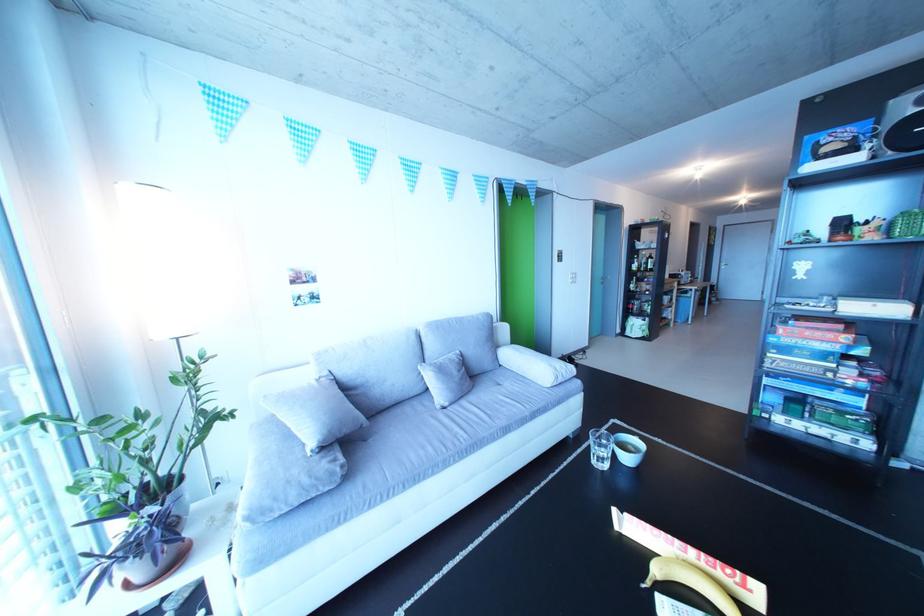
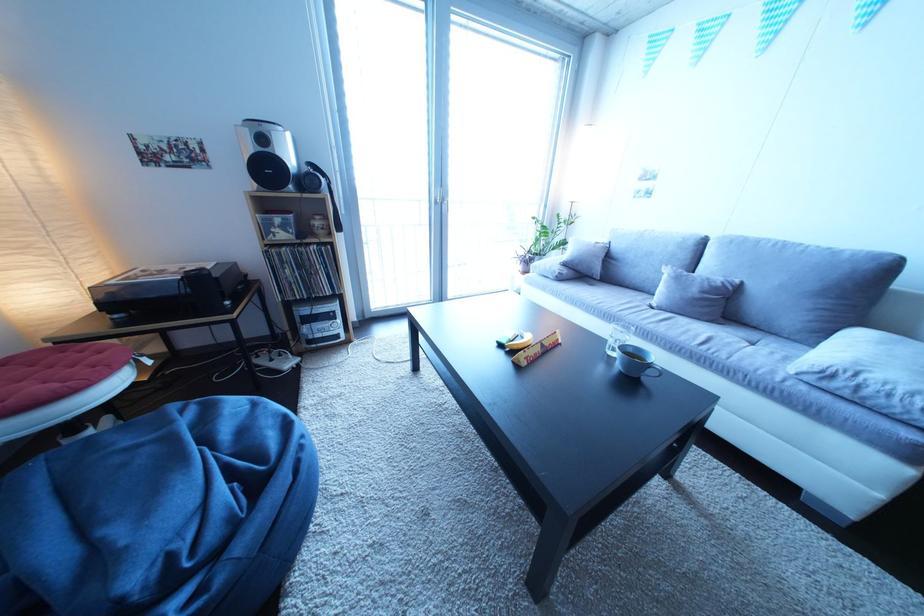
Where in the second image is the point corresponding to pixel 470 358 from the first image?

(750, 286)